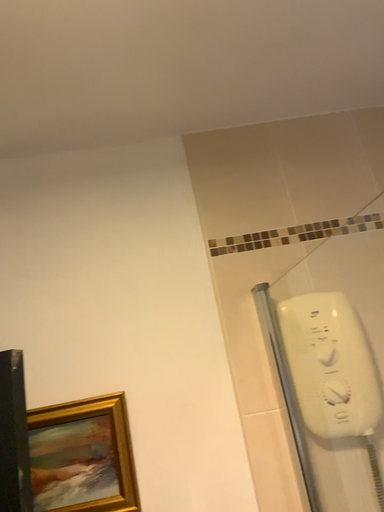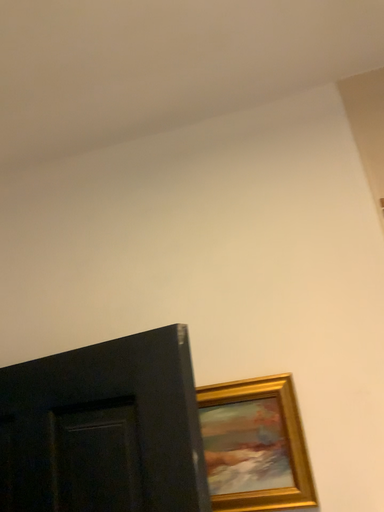
Question: How did the camera likely rotate when shooting the video?

Choices:
 (A) rotated right
 (B) rotated left

Answer: (B)